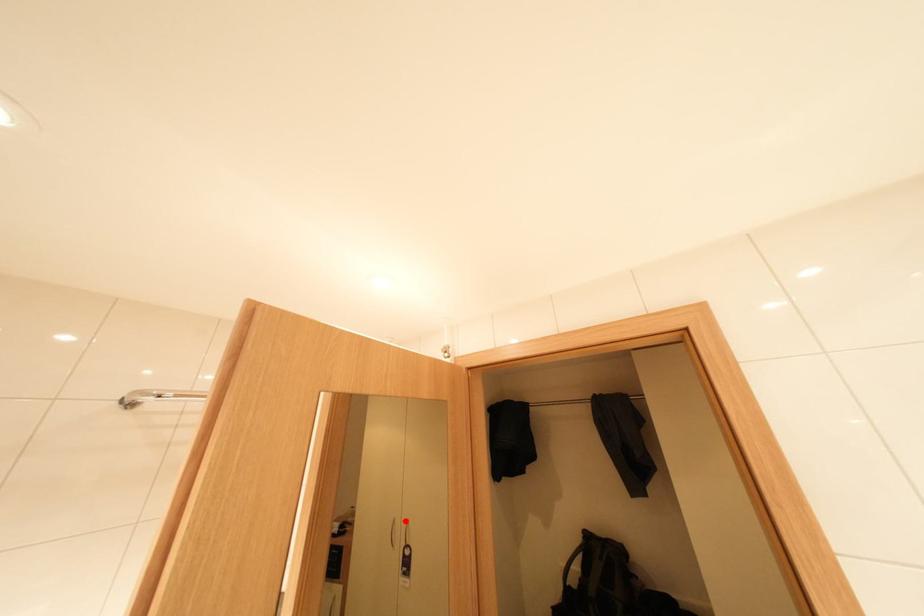
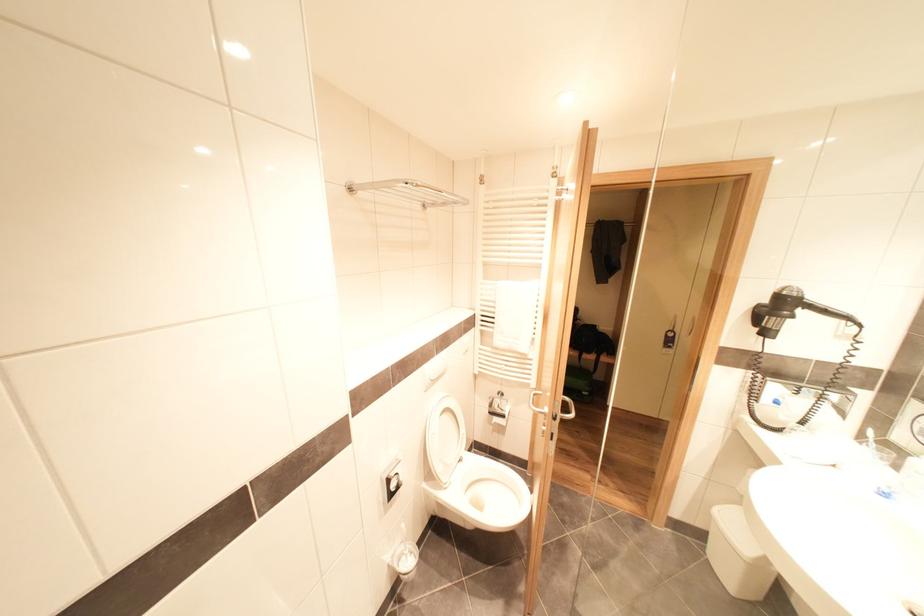
Question: I am providing you with two images of the same scene from different viewpoints. A red point is marked on the first image. Is the red point's position out of view in image 2?

Choices:
 (A) Yes
 (B) No

Answer: (A)